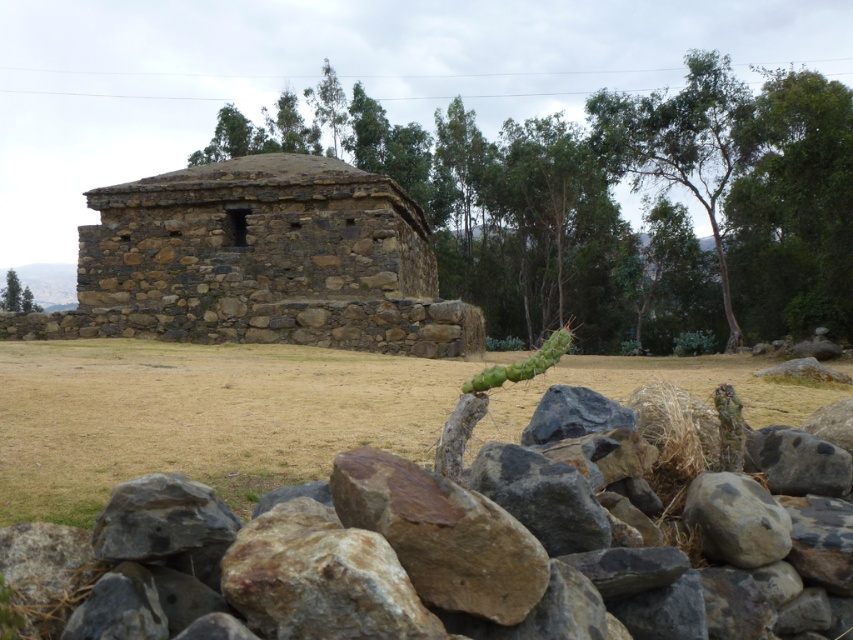
You are standing at the origin point in the image. Where is the brown stone building at center located in terms of coordinates?

The brown stone building at center is located at coordinates point (645, 211).